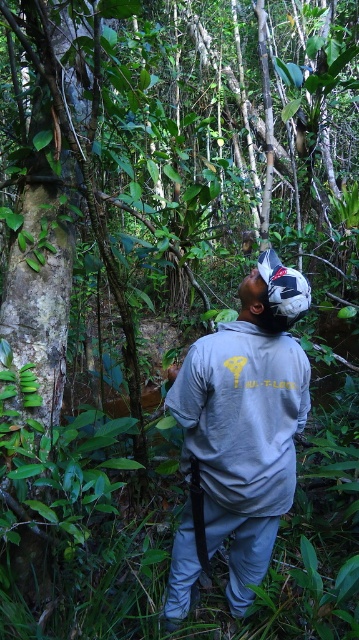
Question: In this image, where is gray fabric shirt at center located relative to gray matte sweatshirt at center?

Choices:
 (A) right
 (B) left

Answer: (B)

Question: Which of the following is the closest to the observer?

Choices:
 (A) gray matte sweatshirt at center
 (B) gray fabric shirt at center

Answer: (B)

Question: Is gray fabric shirt at center further to the viewer compared to gray matte sweatshirt at center?

Choices:
 (A) no
 (B) yes

Answer: (A)

Question: Where is gray fabric shirt at center located in relation to gray matte sweatshirt at center in the image?

Choices:
 (A) right
 (B) left

Answer: (B)

Question: Which point appears closest to the camera in this image?

Choices:
 (A) (283, 493)
 (B) (178, 532)

Answer: (A)